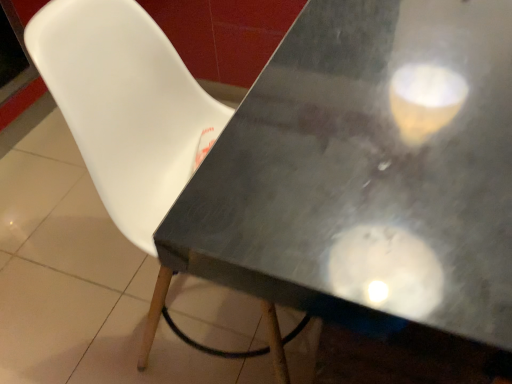
The image size is (512, 384). In order to click on vacant area situated below white plastic chair at center (from a real-world perspective) in this screenshot , I will do `click(220, 333)`.